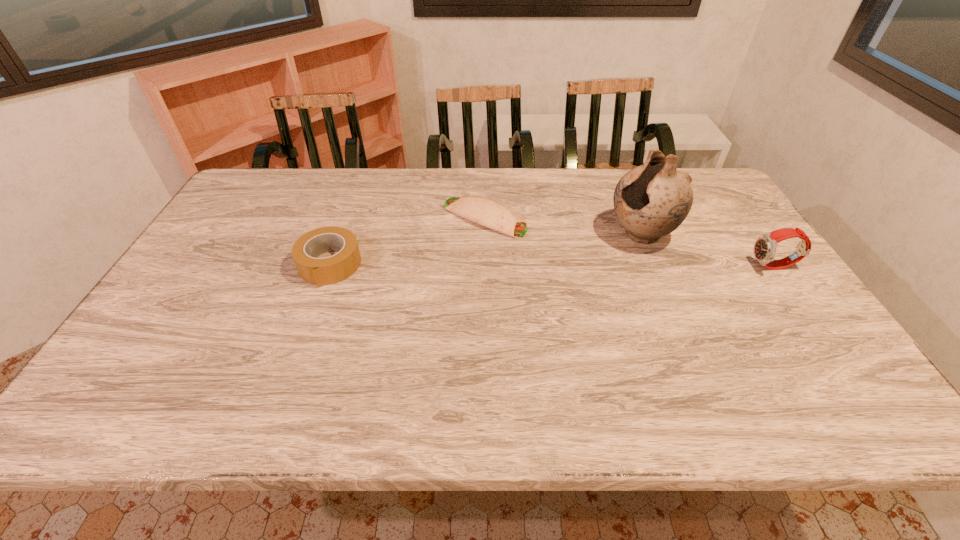
Locate an element on the screen. The height and width of the screenshot is (540, 960). vacant space at the far edge of the desktop is located at coordinates (562, 195).

The width and height of the screenshot is (960, 540). I want to click on vacant space at the near edge of the desktop, so click(206, 359).

In the image, there is a desktop. Where is `blank space at the left edge`? The image size is (960, 540). blank space at the left edge is located at coordinates (214, 278).

In the image, there is a desktop. Where is `vacant space at the near left corner`? Image resolution: width=960 pixels, height=540 pixels. vacant space at the near left corner is located at coordinates (121, 356).

Find the location of `free location at the near right corner`. free location at the near right corner is located at coordinates (775, 346).

Find the location of `free area in between the tallest object and the rightmost object`. free area in between the tallest object and the rightmost object is located at coordinates [708, 251].

At what (x,y) coordinates should I click in order to perform the action: click on empty space between the third object from right to left and the leftmost object. Please return your answer as a coordinate pair (x, y). Image resolution: width=960 pixels, height=540 pixels. Looking at the image, I should click on (407, 241).

This screenshot has width=960, height=540. I want to click on vacant area that lies between the duct tape and the rightmost object, so click(x=552, y=266).

Identify the location of vacant area that lies between the third object from left to right and the burrito. This screenshot has height=540, width=960. (563, 226).

The width and height of the screenshot is (960, 540). Identify the location of free space between the third shortest object and the second object from left to right. (629, 242).